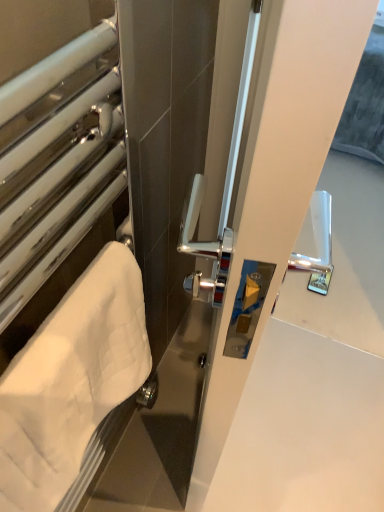
Question: Is white quilted towel at left closer to camera compared to white towel at left?

Choices:
 (A) no
 (B) yes

Answer: (A)

Question: Does white quilted towel at left have a lesser width compared to white towel at left?

Choices:
 (A) no
 (B) yes

Answer: (B)

Question: Is white quilted towel at left positioned behind white towel at left?

Choices:
 (A) yes
 (B) no

Answer: (A)

Question: Is white quilted towel at left facing towards white towel at left?

Choices:
 (A) no
 (B) yes

Answer: (B)

Question: From the image's perspective, is white quilted towel at left beneath white towel at left?

Choices:
 (A) no
 (B) yes

Answer: (B)

Question: From a real-world perspective, is white quilted towel at left located beneath white towel at left?

Choices:
 (A) yes
 (B) no

Answer: (A)

Question: Considering the relative positions of white towel at left and white quilted towel at left in the image provided, is white towel at left to the left of white quilted towel at left from the viewer's perspective?

Choices:
 (A) yes
 (B) no

Answer: (A)

Question: Is white towel at left positioned in front of white quilted towel at left?

Choices:
 (A) yes
 (B) no

Answer: (A)

Question: Is white towel at left positioned far away from white quilted towel at left?

Choices:
 (A) yes
 (B) no

Answer: (B)

Question: Does white towel at left contain white quilted towel at left?

Choices:
 (A) no
 (B) yes

Answer: (B)

Question: Is white towel at left completely or partially outside of white quilted towel at left?

Choices:
 (A) yes
 (B) no

Answer: (A)

Question: Is the surface of white towel at left in direct contact with white quilted towel at left?

Choices:
 (A) yes
 (B) no

Answer: (B)

Question: Is white towel at left wider or thinner than white quilted towel at left?

Choices:
 (A) wide
 (B) thin

Answer: (A)